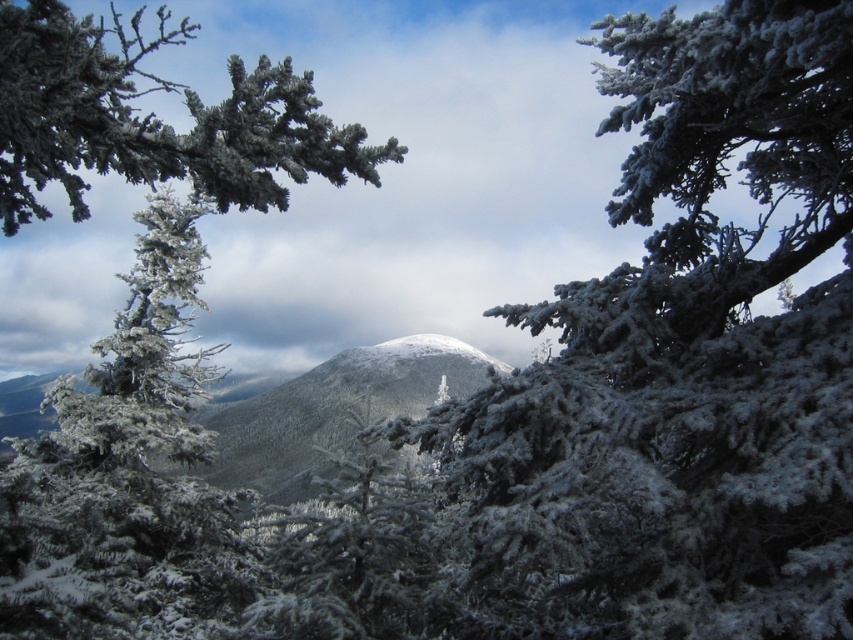
Question: Does frosted pine tree at center have a lesser width compared to frosted pine branch at upper left?

Choices:
 (A) no
 (B) yes

Answer: (B)

Question: Which point appears farthest from the camera in this image?

Choices:
 (A) (169, 42)
 (B) (15, 582)
 (C) (258, 488)

Answer: (C)

Question: Which point appears closest to the camera in this image?

Choices:
 (A) (154, 509)
 (B) (392, 339)
 (C) (39, 70)

Answer: (C)

Question: Does frosted pine tree at center come in front of frosted pine branch at upper left?

Choices:
 (A) no
 (B) yes

Answer: (B)

Question: Which point is closer to the camera?

Choices:
 (A) pyautogui.click(x=10, y=96)
 (B) pyautogui.click(x=224, y=435)

Answer: (A)

Question: Can you confirm if frosted pine branch at upper left is positioned below white frosty mountain at center?

Choices:
 (A) no
 (B) yes

Answer: (A)